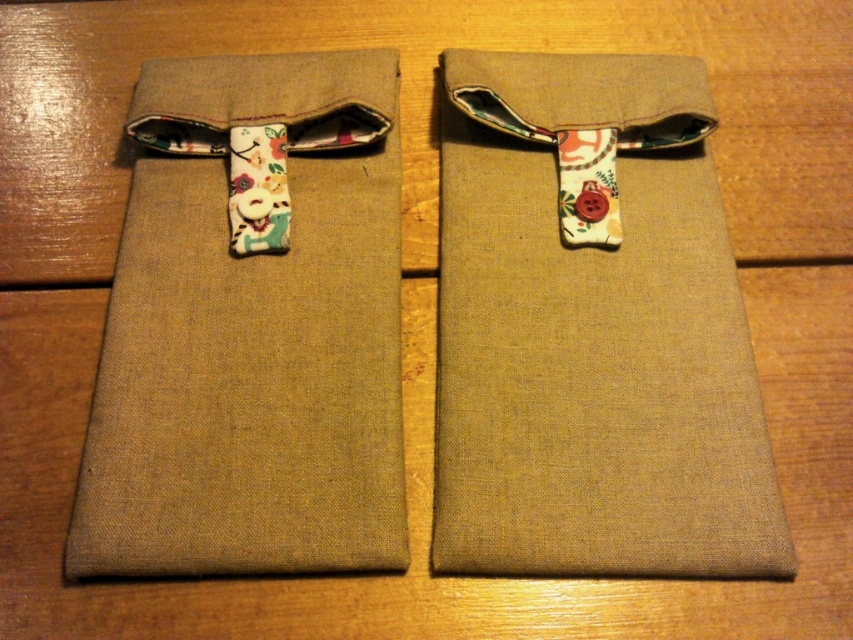
Question: Considering the real-world distances, which object is farthest from the matte beige fabric pouch at left?

Choices:
 (A) floral fabric strap at upper center
 (B) floral fabric tie at center
 (C) matte brown fabric pouch at center

Answer: (A)

Question: Is matte beige fabric pouch at left smaller than floral fabric tie at center?

Choices:
 (A) yes
 (B) no

Answer: (B)

Question: Considering the real-world distances, which object is closest to the matte beige fabric pouch at left?

Choices:
 (A) matte brown fabric pouch at center
 (B) floral fabric tie at center
 (C) floral fabric strap at upper center

Answer: (B)

Question: Does matte brown fabric pouch at center have a greater width compared to floral fabric tie at center?

Choices:
 (A) yes
 (B) no

Answer: (A)

Question: Which of the following is the closest to the observer?

Choices:
 (A) floral fabric strap at upper center
 (B) matte beige fabric pouch at left
 (C) matte brown fabric pouch at center
 (D) floral fabric tie at center

Answer: (B)

Question: Is matte beige fabric pouch at left below floral fabric strap at upper center?

Choices:
 (A) yes
 (B) no

Answer: (A)